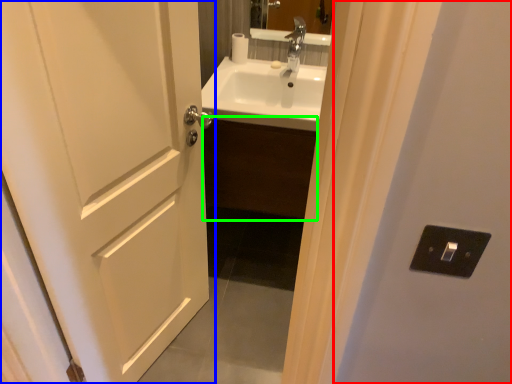
Question: Considering the real-world distances, which object is closest to screen door (highlighted by a red box)? door (highlighted by a blue box) or cabinetry (highlighted by a green box).

Choices:
 (A) door
 (B) cabinetry

Answer: (A)